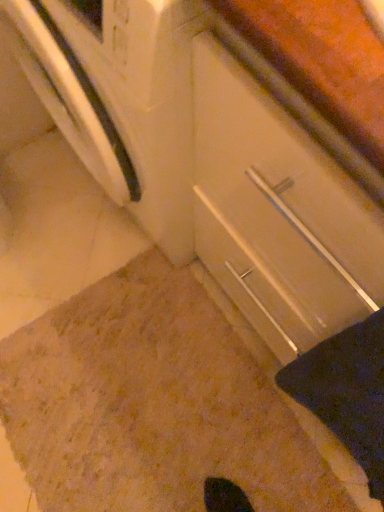
This screenshot has height=512, width=384. I want to click on free area below brown textured carpet at lower center (from a real-world perspective), so click(x=201, y=435).